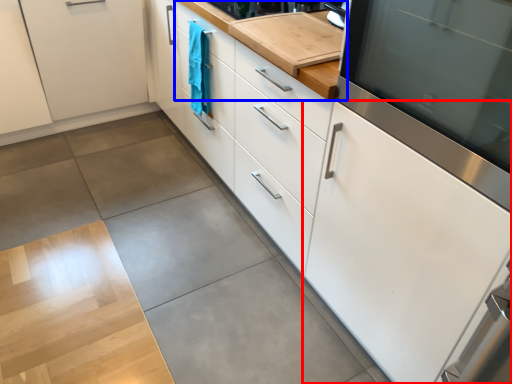
Question: Which object appears closest to the camera in this image, cabinetry (highlighted by a red box) or countertop (highlighted by a blue box)?

Choices:
 (A) cabinetry
 (B) countertop

Answer: (A)